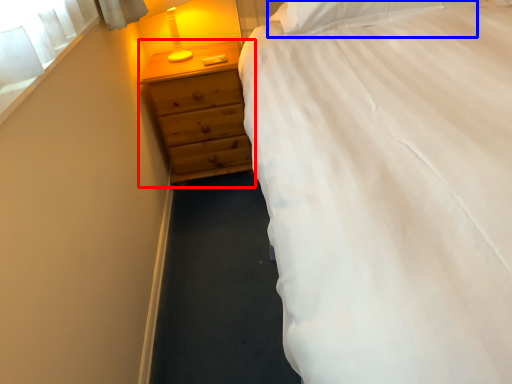
Question: Which of the following is the closest to the observer, chest of drawers (highlighted by a red box) or pillow (highlighted by a blue box)?

Choices:
 (A) chest of drawers
 (B) pillow

Answer: (B)